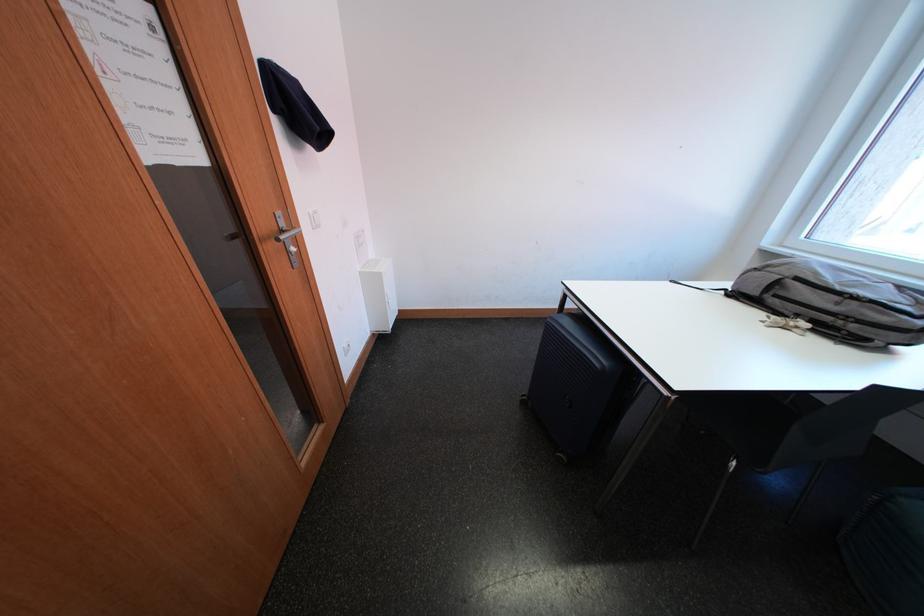
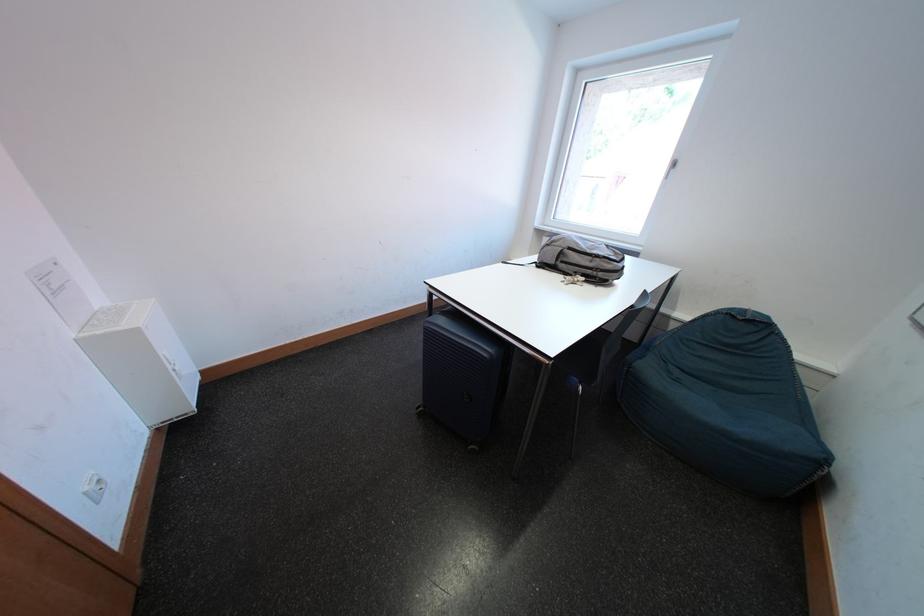
Find the pixel in the second image that matches point (846, 307) in the first image.

(601, 265)